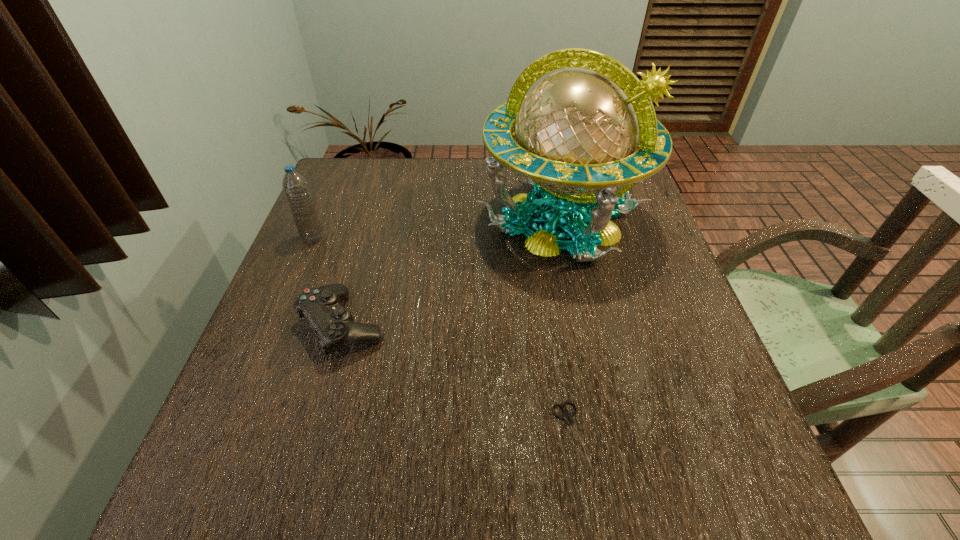
This screenshot has width=960, height=540. Find the location of `vacant space at the right edge of the desktop`. vacant space at the right edge of the desktop is located at coordinates (614, 276).

Where is `vacant space at the far left corner of the desktop`? The height and width of the screenshot is (540, 960). vacant space at the far left corner of the desktop is located at coordinates (361, 202).

Identify the location of vacant space at the near right corner of the desktop. (663, 468).

The image size is (960, 540). I want to click on free space between the globe and the nearest object, so click(x=565, y=327).

The height and width of the screenshot is (540, 960). What are the coordinates of `vacant region between the water bottle and the control` in the screenshot? It's located at (328, 281).

Locate an element on the screen. vacant region between the tallest object and the leftmost object is located at coordinates (437, 229).

Identify the location of free space between the leftmost object and the nearest object. (442, 335).

Find the location of `free point between the water bottle and the globe`. free point between the water bottle and the globe is located at coordinates (437, 229).

Identify the location of vacant space in between the control and the water bottle. Image resolution: width=960 pixels, height=540 pixels. (328, 281).

Identify the location of vacant area between the water bottle and the globe. The width and height of the screenshot is (960, 540). (437, 229).